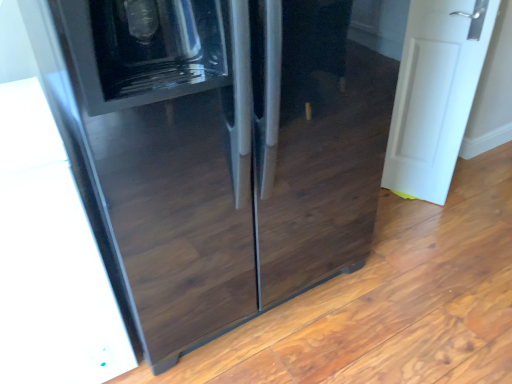
Question: Would you say glossy black refrigerator at center is to the left or to the right of white matte door at right in the picture?

Choices:
 (A) left
 (B) right

Answer: (A)

Question: From a real-world perspective, is glossy black refrigerator at center physically located above or below white matte door at right?

Choices:
 (A) above
 (B) below

Answer: (A)

Question: Considering the positions of glossy black refrigerator at center and white matte door at right in the image, is glossy black refrigerator at center taller or shorter than white matte door at right?

Choices:
 (A) short
 (B) tall

Answer: (B)

Question: From a real-world perspective, is white matte door at right positioned above or below glossy black refrigerator at center?

Choices:
 (A) above
 (B) below

Answer: (B)

Question: Choose the correct answer: Is white matte door at right inside glossy black refrigerator at center or outside it?

Choices:
 (A) outside
 (B) inside

Answer: (A)

Question: Based on their positions, is white matte door at right located to the left or right of glossy black refrigerator at center?

Choices:
 (A) left
 (B) right

Answer: (B)

Question: Is point (406, 150) positioned closer to the camera than point (204, 76)?

Choices:
 (A) farther
 (B) closer

Answer: (A)